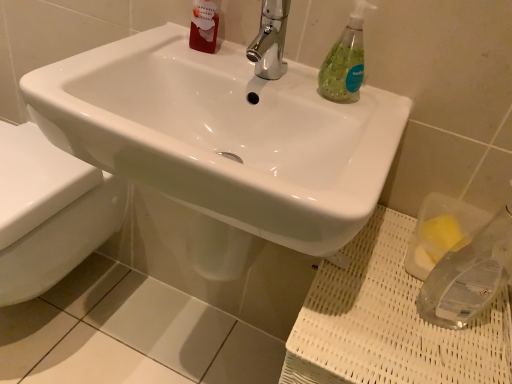
Question: From a real-world perspective, is green translucent soap dispenser at upper right positioned over white glossy sink at center based on gravity?

Choices:
 (A) yes
 (B) no

Answer: (A)

Question: Would you consider green translucent soap dispenser at upper right to be distant from white glossy sink at center?

Choices:
 (A) yes
 (B) no

Answer: (B)

Question: From a real-world perspective, is green translucent soap dispenser at upper right below white glossy sink at center?

Choices:
 (A) yes
 (B) no

Answer: (B)

Question: Does green translucent soap dispenser at upper right appear on the right side of white glossy sink at center?

Choices:
 (A) yes
 (B) no

Answer: (A)

Question: Does green translucent soap dispenser at upper right have a larger size compared to white glossy sink at center?

Choices:
 (A) no
 (B) yes

Answer: (A)

Question: Does green translucent soap dispenser at upper right come behind white glossy sink at center?

Choices:
 (A) yes
 (B) no

Answer: (A)

Question: Considering the relative sizes of clear plastic sponge at lower right and chrome metallic faucet at upper center in the image provided, is clear plastic sponge at lower right wider than chrome metallic faucet at upper center?

Choices:
 (A) yes
 (B) no

Answer: (A)

Question: From the image's perspective, does clear plastic sponge at lower right appear lower than chrome metallic faucet at upper center?

Choices:
 (A) no
 (B) yes

Answer: (B)

Question: From a real-world perspective, is clear plastic sponge at lower right over chrome metallic faucet at upper center?

Choices:
 (A) no
 (B) yes

Answer: (A)

Question: Does clear plastic sponge at lower right have a lesser height compared to chrome metallic faucet at upper center?

Choices:
 (A) yes
 (B) no

Answer: (B)

Question: Is the surface of clear plastic sponge at lower right in direct contact with chrome metallic faucet at upper center?

Choices:
 (A) yes
 (B) no

Answer: (B)

Question: Is clear plastic sponge at lower right not near chrome metallic faucet at upper center?

Choices:
 (A) yes
 (B) no

Answer: (B)

Question: Is the depth of chrome metallic faucet at upper center greater than that of clear plastic sponge at lower right?

Choices:
 (A) no
 (B) yes

Answer: (B)